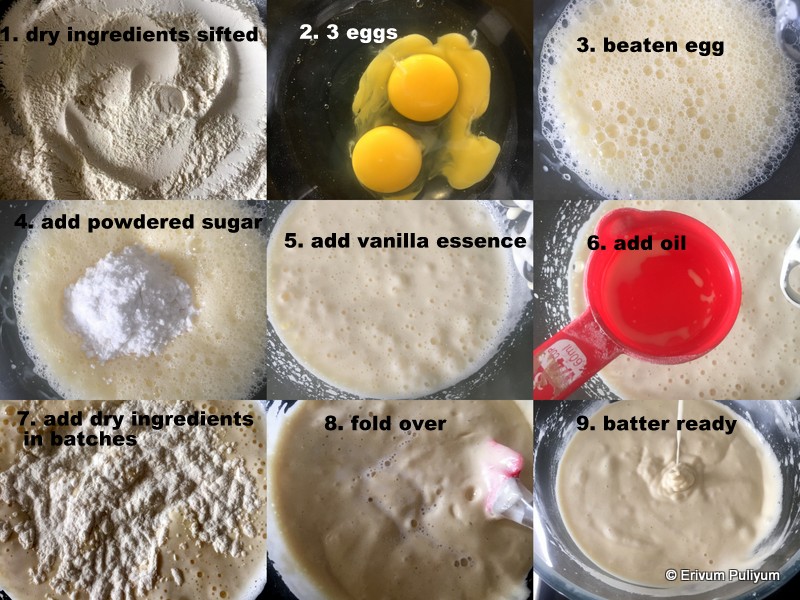
Find the location of a particular element. The image size is (800, 600). glass bowl is located at coordinates (564, 574), (13, 364), (288, 383), (545, 300).